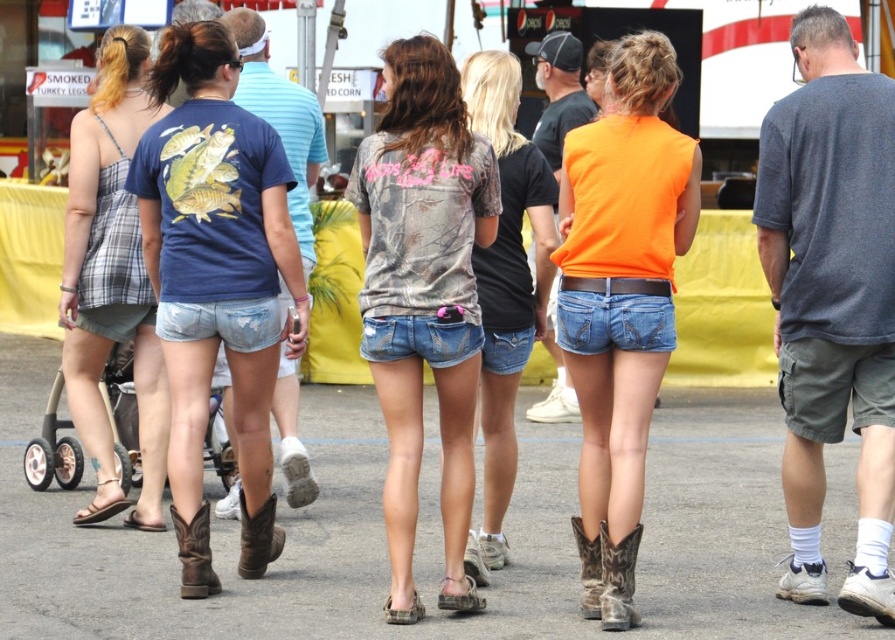
Question: Which point is farther to the camera?

Choices:
 (A) (158, 436)
 (B) (389, 268)

Answer: (A)

Question: Which point is farther to the camera?

Choices:
 (A) brown leather cowboy boot at lower left
 (B) brown leather boot at lower left

Answer: (B)

Question: Which of the following is the closest to the observer?

Choices:
 (A) brown leather boot at lower center
 (B) brown leather boots at lower left

Answer: (A)

Question: In this image, where is washed denim shorts at center located relative to orange matte tank top at center?

Choices:
 (A) right
 (B) left

Answer: (B)

Question: Can you confirm if brown leather boots at lower left is bigger than brown leather cowboy boot at lower left?

Choices:
 (A) no
 (B) yes

Answer: (B)

Question: Is plaid fabric dress at left wider than brown leather boot at lower left?

Choices:
 (A) no
 (B) yes

Answer: (B)